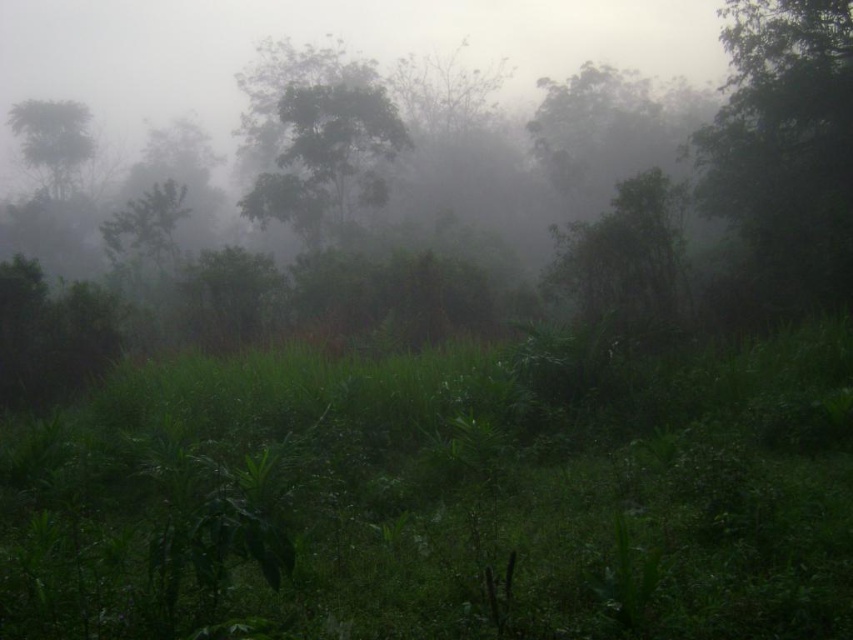
Question: Which point is farther to the camera?

Choices:
 (A) green leafy tree at right
 (B) green leafy grass at center

Answer: (A)

Question: Is the position of green leafy grass at center more distant than that of green leafy tree at right?

Choices:
 (A) no
 (B) yes

Answer: (A)

Question: Which point appears farthest from the camera in this image?

Choices:
 (A) (839, 166)
 (B) (723, 564)

Answer: (A)

Question: Is green leafy grass at center smaller than green leafy tree at right?

Choices:
 (A) no
 (B) yes

Answer: (B)

Question: Does green leafy grass at center appear on the left side of green leafy tree at right?

Choices:
 (A) no
 (B) yes

Answer: (B)